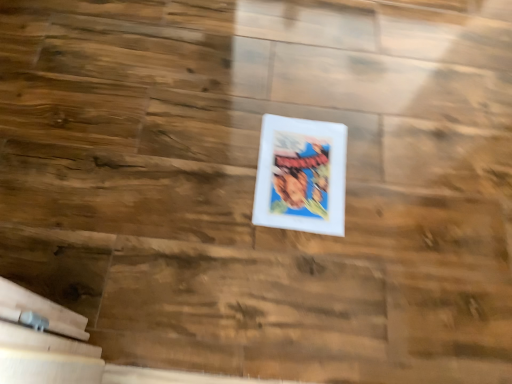
Question: Should I look upward or downward to see white matte picture frame at center?

Choices:
 (A) up
 (B) down

Answer: (A)